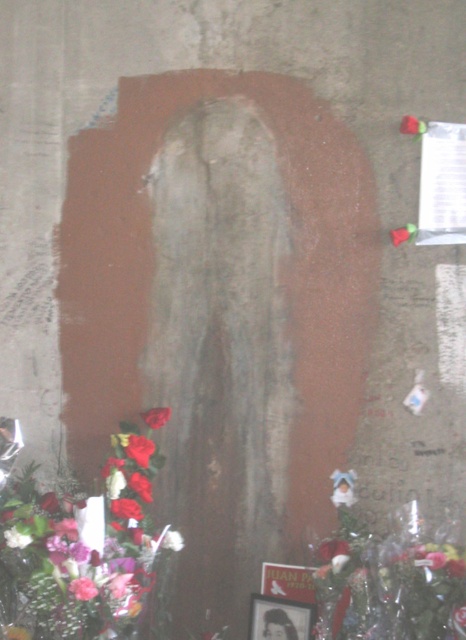
Measure the distance from smooth glossy roses at lower left to white paper at upper right.

smooth glossy roses at lower left and white paper at upper right are 22.20 inches apart from each other.

Measure the distance between point (87, 557) and camera.

A distance of 5.66 feet exists between point (87, 557) and camera.

The image size is (466, 640). What do you see at coordinates (80, 552) in the screenshot? I see `smooth glossy roses at lower left` at bounding box center [80, 552].

You are a GUI agent. You are given a task and a screenshot of the screen. Output one action in this format:
    pyautogui.click(x=<x>, y=<y>)
    Task: Click on the smooth glossy roses at lower left
    
    Given the screenshot: What is the action you would take?
    pyautogui.click(x=80, y=552)

Is white paper at upper right further to the viewer compared to red matte rose at lower left?

Yes, it is behind red matte rose at lower left.

Does white paper at upper right appear over red matte rose at lower left?

Yes, white paper at upper right is above red matte rose at lower left.

This screenshot has height=640, width=466. Identify the location of white paper at upper right. (441, 184).

Who is lower down, smooth glossy roses at lower left or red matte rose at lower left?

smooth glossy roses at lower left is lower down.

Is smooth glossy roses at lower left bigger than red matte rose at lower left?

Yes, smooth glossy roses at lower left is bigger than red matte rose at lower left.

You are a GUI agent. You are given a task and a screenshot of the screen. Output one action in this format:
    pyautogui.click(x=<x>, y=<y>)
    Task: Click on the smooth glossy roses at lower left
    This screenshot has height=640, width=466.
    Given the screenshot: What is the action you would take?
    pyautogui.click(x=80, y=552)